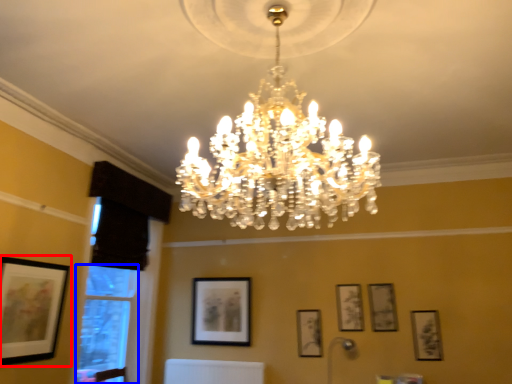
Question: Which object appears farthest to the camera in this image, picture frame (highlighted by a red box) or window (highlighted by a blue box)?

Choices:
 (A) picture frame
 (B) window

Answer: (B)